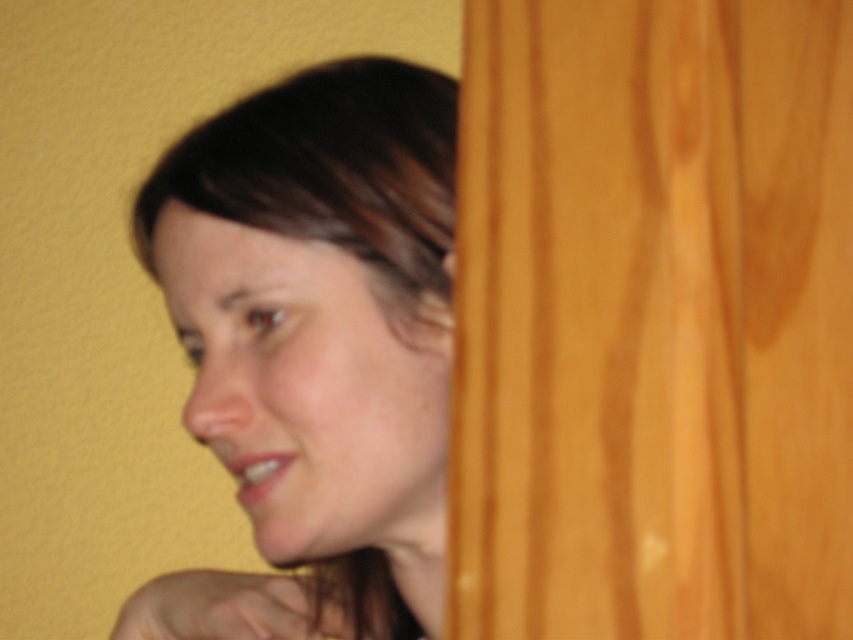
Is matte skin face at center positioned at the back of dark brown hair at upper left?

No, it is not.

Is point (241, 412) closer to viewer compared to point (407, 182)?

Yes, point (241, 412) is closer to viewer.

Between point (381, 300) and point (331, 83), which one is positioned in front?

Point (381, 300) is more forward.

Where is `matte skin face at center`? matte skin face at center is located at coordinates click(x=314, y=348).